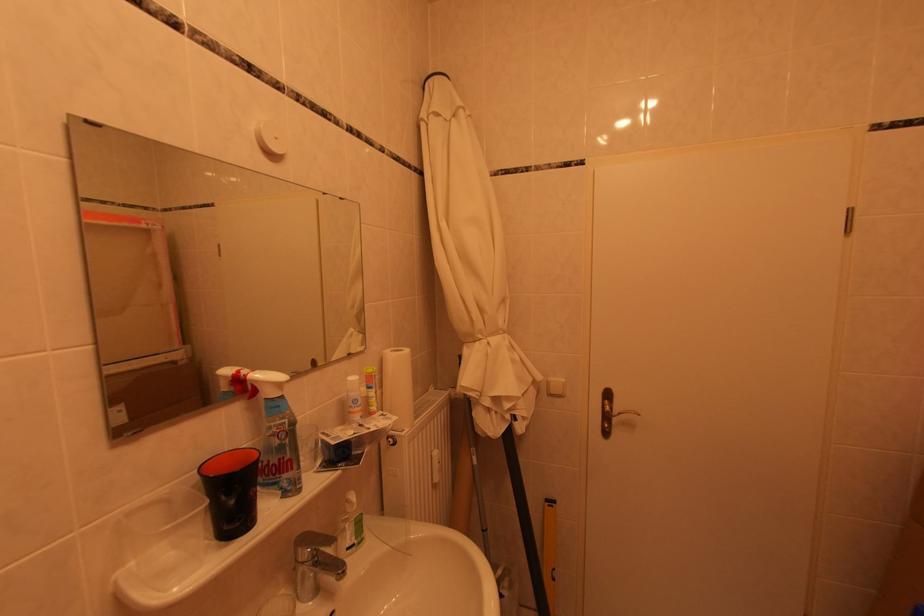
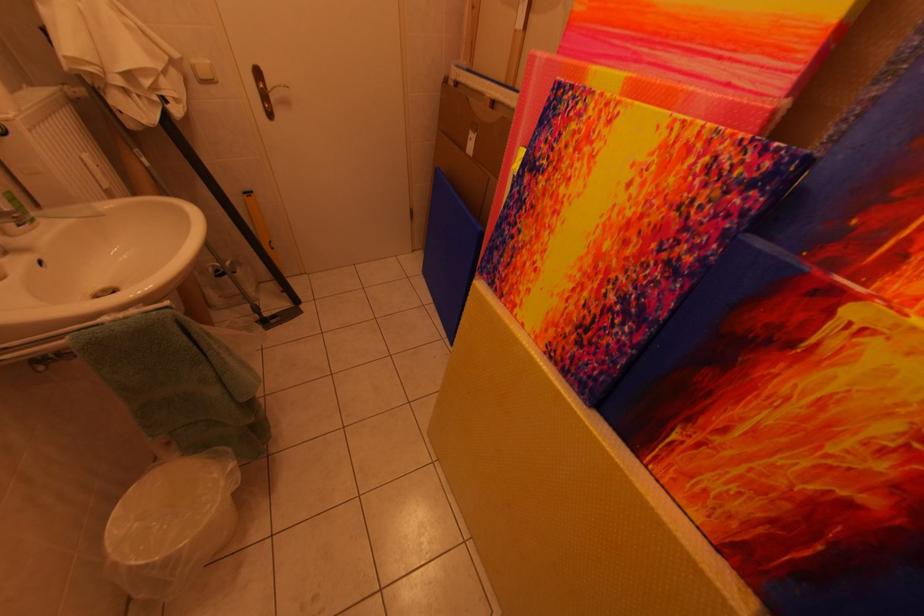
The point at [560,383] is marked in the first image. Where is the corresponding point in the second image?

(203, 65)